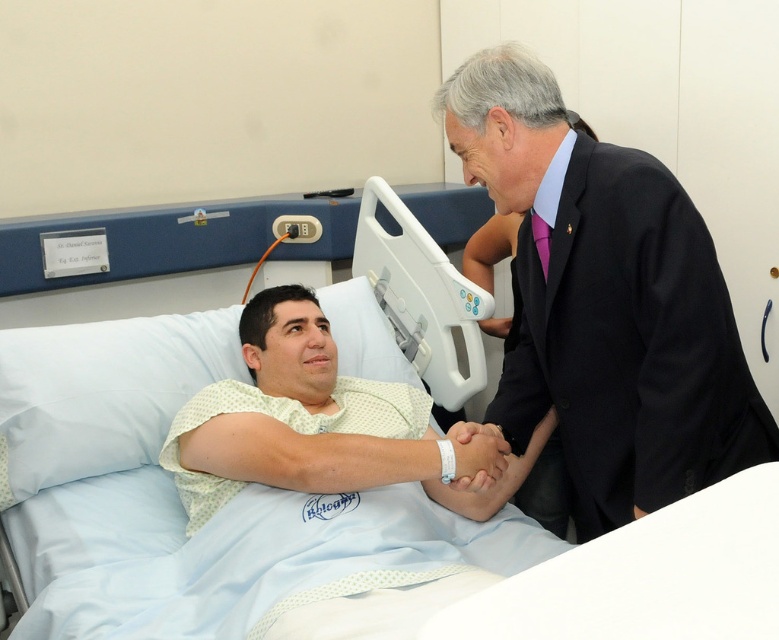
You are a nurse in the hospital. You need to move a medical chart from the black satin business suit at right to the light blue fabric hospital bed at center. Can you place it directly on top without lifting the bed?

The light blue fabric hospital bed at center is below the black satin business suit at right, so yes, you can place the medical chart directly on top without lifting the bed.

You are a nurse checking the hospital room. You need to adjust the height of the light blue fabric hospital bed at center so that the headrest reaches the same level as the collar of the black satin business suit at right. Is the bed currently higher or lower than the collar of the suit?

The light blue fabric hospital bed at center has a lesser height compared to the black satin business suit at right, so the bed is currently lower than the collar of the suit.

You are a medical student observing the scene. You notice two points marked in the image. The first point is at coordinates point (x=147, y=387) and the second is at point (x=654, y=481). Which point is closer to you?

Point (x=147, y=387) is closer to you because it is further to the camera than point (x=654, y=481).